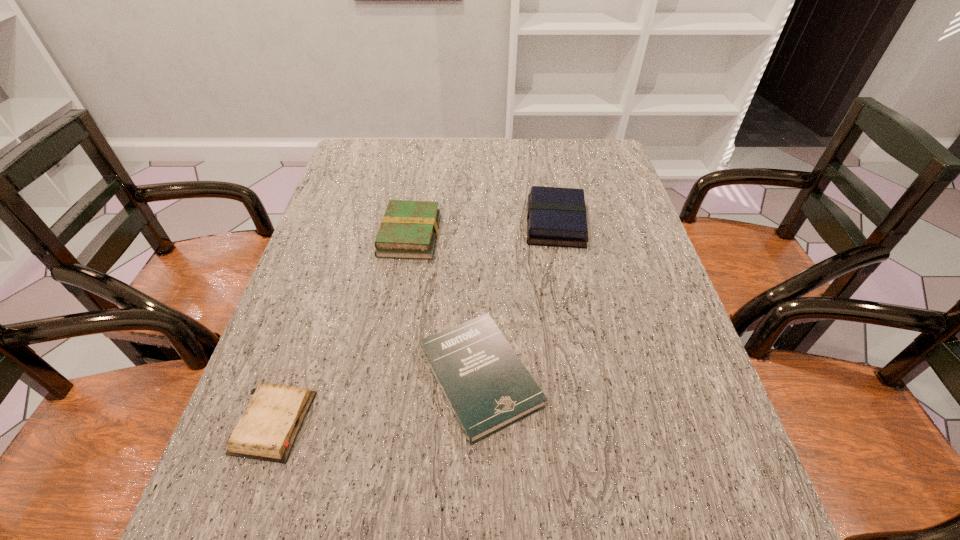
The height and width of the screenshot is (540, 960). In order to click on the second shortest object in this screenshot , I will do `click(488, 388)`.

In order to click on the shortest book in this screenshot , I will do `click(488, 388)`.

Where is `the leftmost object`? The width and height of the screenshot is (960, 540). the leftmost object is located at coordinates (275, 414).

Find the location of a particular element. The image size is (960, 540). diary is located at coordinates (275, 414).

Where is `blank space located 0.060m on the right of the nearest book`? Image resolution: width=960 pixels, height=540 pixels. blank space located 0.060m on the right of the nearest book is located at coordinates (572, 377).

At what (x,y) coordinates should I click in order to perform the action: click on vacant space situated 0.070m on the back of the leftmost object. Please return your answer as a coordinate pair (x, y). The height and width of the screenshot is (540, 960). Looking at the image, I should click on (297, 356).

Locate an element on the screen. object that is at the left edge is located at coordinates (275, 414).

What are the coordinates of `object that is at the right edge` in the screenshot? It's located at (556, 217).

What are the coordinates of `vacant space at the far edge` in the screenshot? It's located at (456, 145).

At what (x,y) coordinates should I click in order to perform the action: click on blank space at the near edge of the desktop. Please return your answer as a coordinate pair (x, y). Looking at the image, I should click on (622, 529).